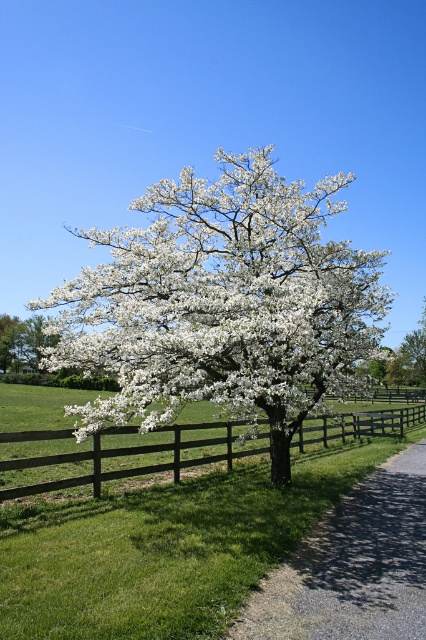
Question: Can you confirm if brown wooden fence at center is positioned below white blossoming tree at center?

Choices:
 (A) no
 (B) yes

Answer: (B)

Question: Which object is closer to the camera taking this photo?

Choices:
 (A) gravel at lower right
 (B) brown wooden fence at center

Answer: (A)

Question: Which point is farther to the camera?

Choices:
 (A) brown wooden fence at center
 (B) white matte flower at center
 (C) white blossoming tree at center

Answer: (C)

Question: Is white matte flower at center above gravel at lower right?

Choices:
 (A) no
 (B) yes

Answer: (B)

Question: Can you confirm if gravel at lower right is wider than brown wooden fence at center?

Choices:
 (A) yes
 (B) no

Answer: (B)

Question: Which point is closer to the camera?

Choices:
 (A) (301, 424)
 (B) (0, 360)
 (C) (207, 221)

Answer: (C)